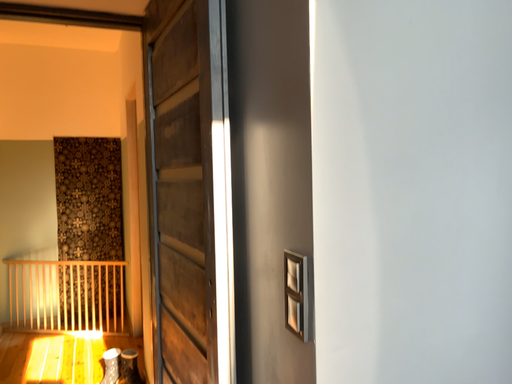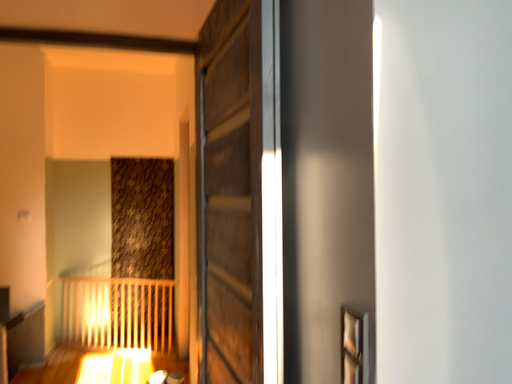
Question: Which way did the camera rotate in the video?

Choices:
 (A) rotated left
 (B) rotated right

Answer: (A)